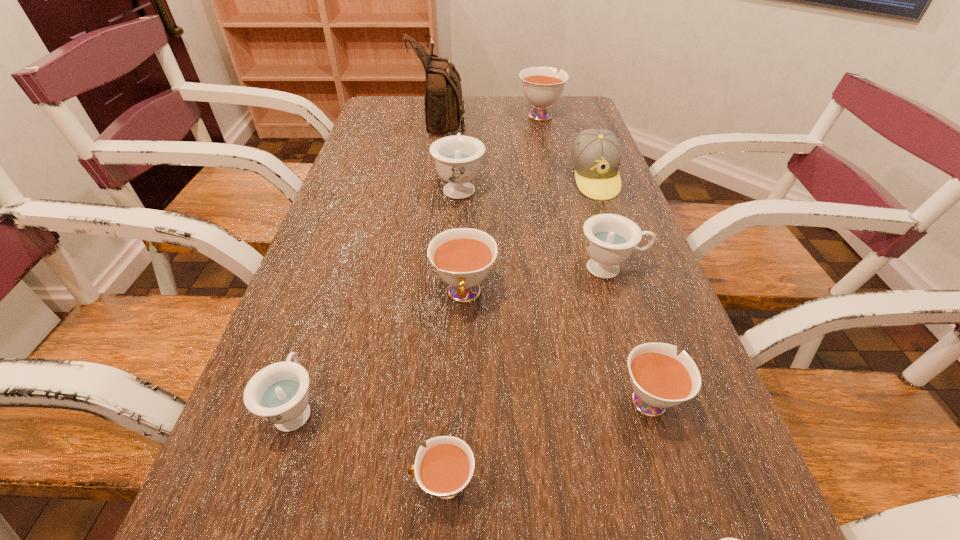
Find the location of a particular element. This screenshot has height=540, width=960. the tallest object is located at coordinates coord(444,105).

Where is `shoulder bag`? The height and width of the screenshot is (540, 960). shoulder bag is located at coordinates (444, 105).

At what (x,y) coordinates should I click in order to perform the action: click on the biggest white teacup. Please return your answer as a coordinate pair (x, y). Image resolution: width=960 pixels, height=540 pixels. Looking at the image, I should click on (542, 87).

You are a GUI agent. You are given a task and a screenshot of the screen. Output one action in this format:
    pyautogui.click(x=<x>, y=<y>)
    Task: Click on the farthest teacup
    
    Given the screenshot: What is the action you would take?
    pyautogui.click(x=542, y=87)

You are a GUI agent. You are given a task and a screenshot of the screen. Output one action in this format:
    pyautogui.click(x=<x>, y=<y>)
    Task: Click on the biggest blue teacup
    
    Given the screenshot: What is the action you would take?
    pyautogui.click(x=457, y=158)

Image resolution: width=960 pixels, height=540 pixels. In order to click on the second blue teacup from left to right in this screenshot , I will do `click(457, 158)`.

You are a GUI agent. You are given a task and a screenshot of the screen. Output one action in this format:
    pyautogui.click(x=<x>, y=<y>)
    Task: Click on the baseball cap
    The height and width of the screenshot is (540, 960).
    Given the screenshot: What is the action you would take?
    pyautogui.click(x=596, y=154)

Image resolution: width=960 pixels, height=540 pixels. What are the coordinates of `the third smallest white teacup` in the screenshot? It's located at (463, 257).

Identify the location of the third nearest blue teacup. (610, 238).

You are a GUI agent. You are given a task and a screenshot of the screen. Output one action in this format:
    pyautogui.click(x=<x>, y=<y>)
    Task: Click on the third biggest white teacup
    The image size is (960, 540).
    Given the screenshot: What is the action you would take?
    pyautogui.click(x=660, y=379)